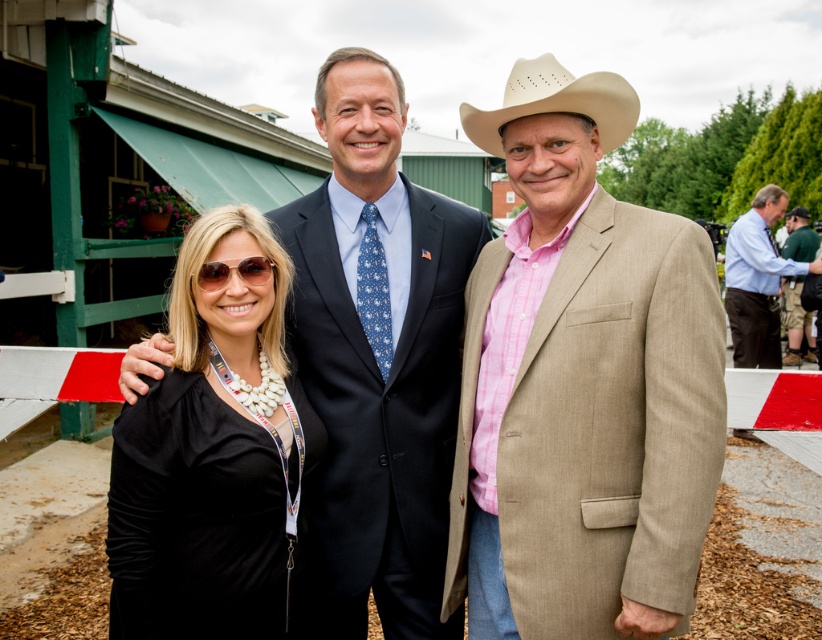
You are trying to decide which person to approach for assistance at the fairground. You see a matte black suit at center and a blue shirt at center. Which one is more likely to be a staff member based on their clothing height?

The matte black suit at center is much taller than the blue shirt at center, so the person in the matte black suit at center is more likely to be a staff member since they are taller and might have a higher position.

You are a photographer at the fairground and need to ensure that both the tan textured suit at center and the beige felt cowboy hat at right are visible in your photo. Given their height difference, which object should you focus on to capture both in frame without cropping?

The tan textured suit at center is taller than the beige felt cowboy hat at right. To capture both without cropping, focus on the tan textured suit at center as the primary subject, ensuring the frame accommodates its height while the shorter beige felt cowboy hat at right remains visible in the composition.